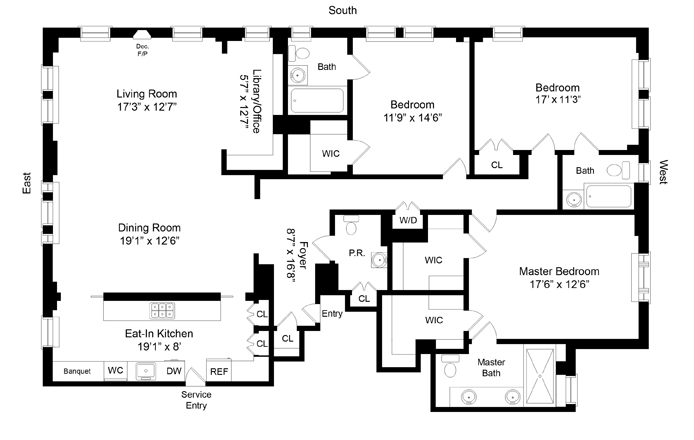
I want to click on master bedroom, so 539,263.